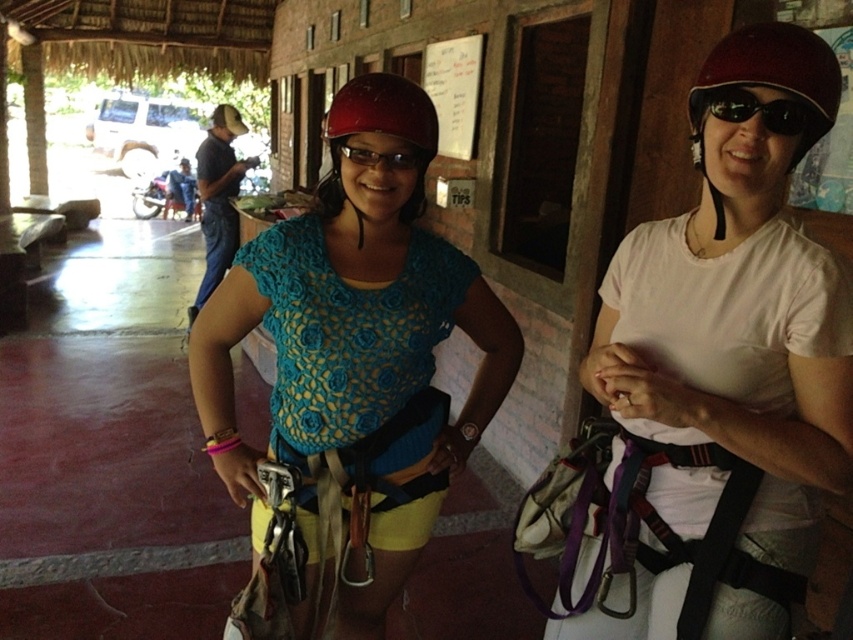
You are a safety inspector checking the equipment of two adventurers. You notice the white matte helmet at center and the matte blue shirt at center. Which item has a smaller width when viewed from the front?

The white matte helmet at center is thinner than the matte blue shirt at center, so the white matte helmet at center has a smaller width when viewed from the front.

You are a photographer positioned in front of the two adventurers. You want to take a photo focusing on the white matte helmet at center and the matte blue shirt at center. Which object will appear larger in the photo?

The white matte helmet at center will appear larger in the photo because it is closer to the viewer than the matte blue shirt at center.

You are an adventurer looking for a map to navigate through a cave system. You see the white paper at upper center and the black plastic goggles at upper right. Which item is positioned to the left of the other?

The white paper at upper center is positioned to the left of the black plastic goggles at upper right.